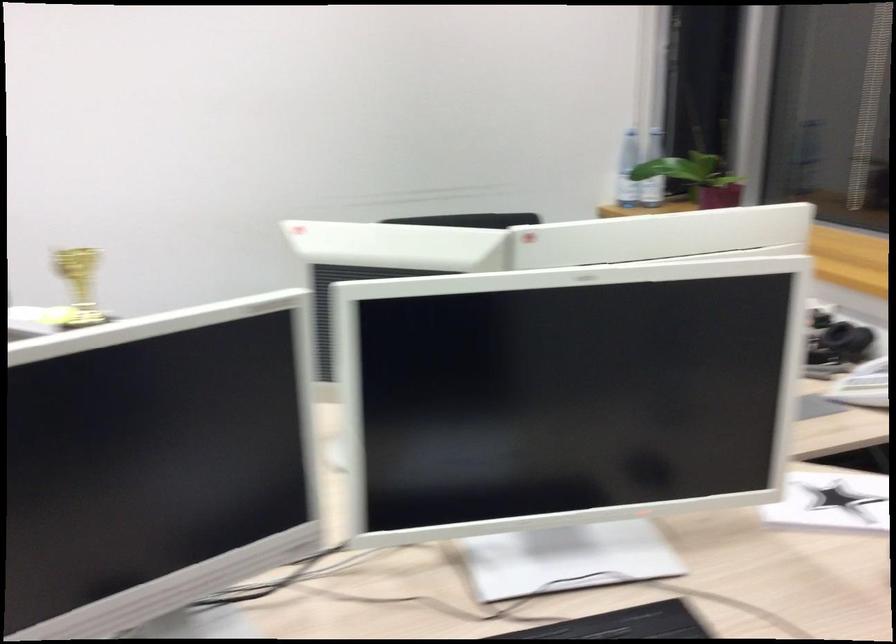
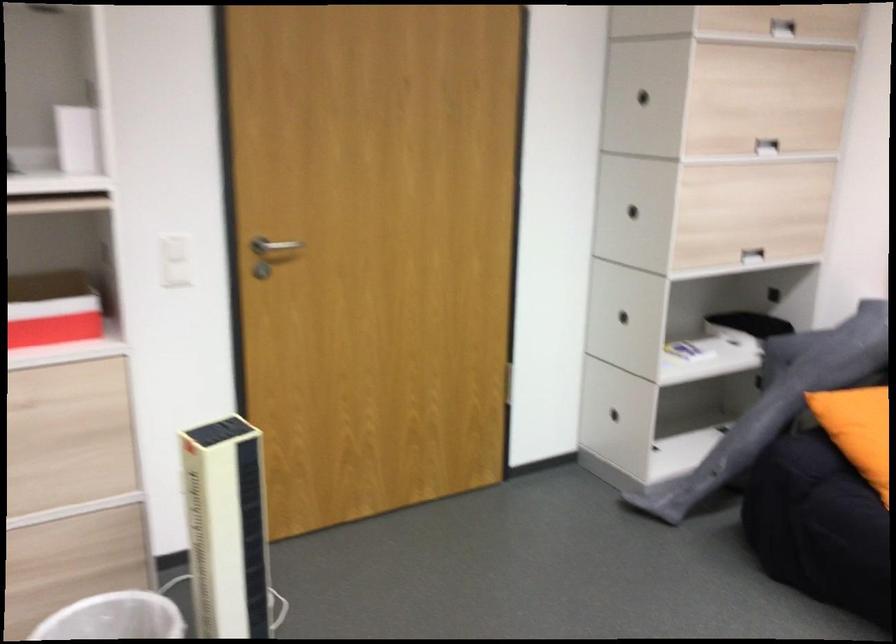
Question: The first image is from the beginning of the video and the second image is from the end. How did the camera likely rotate when shooting the video?

Choices:
 (A) Left
 (B) Right
 (C) Up
 (D) Down

Answer: (A)